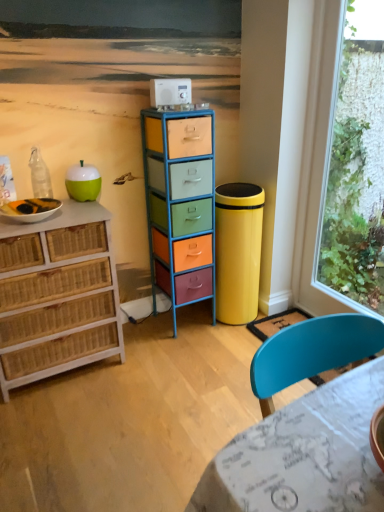
Question: Is point (150, 83) positioned closer to the camera than point (314, 188)?

Choices:
 (A) closer
 (B) farther

Answer: (A)

Question: From the image's perspective, is white plastic appliance at upper center located above or below transparent glass window at right?

Choices:
 (A) above
 (B) below

Answer: (A)

Question: Based on their relative distances, which object is farther from the green matte apple at left?

Choices:
 (A) white plastic appliance at upper center
 (B) transparent glass window at right
 (C) white matte bowl at left
 (D) metallic multicolored drawers at center, placed as the 1th chest of drawers when sorted from right to left
 (E) marble-patterned table at lower right

Answer: (E)

Question: Based on their relative distances, which object is nearer to the white matte bowl at left?

Choices:
 (A) metallic multicolored drawers at center, which is counted as the 2th chest of drawers, starting from the left
 (B) marble-patterned table at lower right
 (C) woven wood chest of drawers at left, placed as the 2th chest of drawers when sorted from right to left
 (D) green matte apple at left
 (E) white plastic appliance at upper center

Answer: (D)